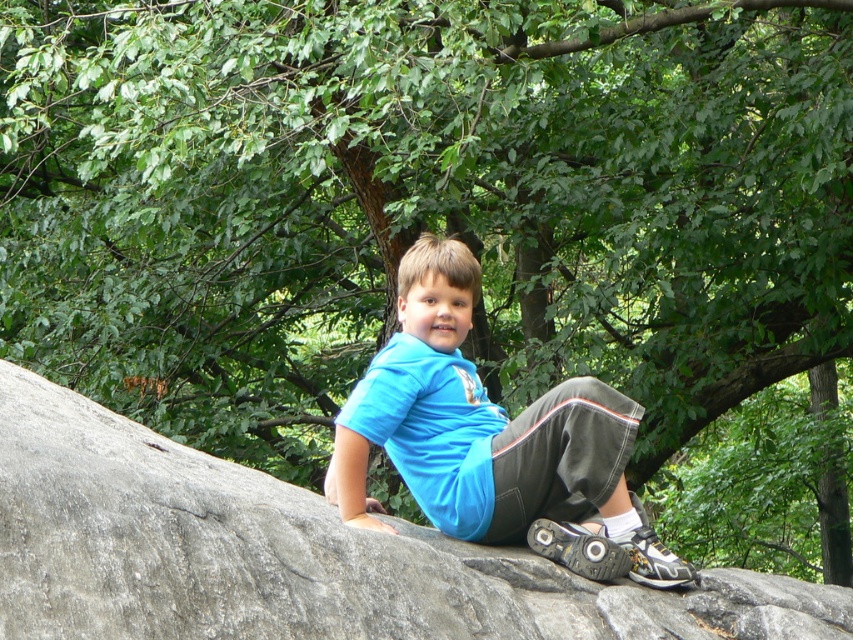
Question: Which of the following is the farthest from the observer?

Choices:
 (A) blue fabric shirt at center
 (B) gray rough rock at center

Answer: (A)

Question: Does gray rough rock at center appear under blue fabric shirt at center?

Choices:
 (A) no
 (B) yes

Answer: (A)

Question: Among these objects, which one is nearest to the camera?

Choices:
 (A) blue fabric shirt at center
 (B) gray rough rock at center

Answer: (B)

Question: Where is gray rough rock at center located in relation to blue fabric shirt at center in the image?

Choices:
 (A) below
 (B) above

Answer: (B)

Question: From the image, what is the correct spatial relationship of gray rough rock at center in relation to blue fabric shirt at center?

Choices:
 (A) above
 (B) below

Answer: (A)